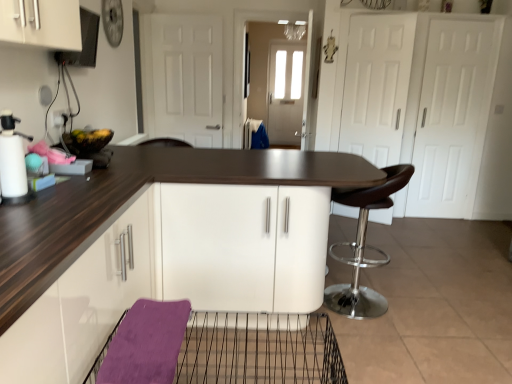
Question: Relative to white matte door at center, is wire mesh basket at lower center in front or behind?

Choices:
 (A) behind
 (B) front

Answer: (B)

Question: From their relative heights in the image, would you say wire mesh basket at lower center is taller or shorter than white matte door at center?

Choices:
 (A) short
 (B) tall

Answer: (A)

Question: Based on their relative distances, which object is nearer to the white matte spray bottle at left?

Choices:
 (A) white matte door at center
 (B) brown leather stool at right
 (C) wire mesh basket at lower center

Answer: (C)

Question: Estimate the real-world distances between objects in this image. Which object is farther from the white matte door at center?

Choices:
 (A) white matte spray bottle at left
 (B) brown leather stool at right
 (C) wire mesh basket at lower center

Answer: (C)